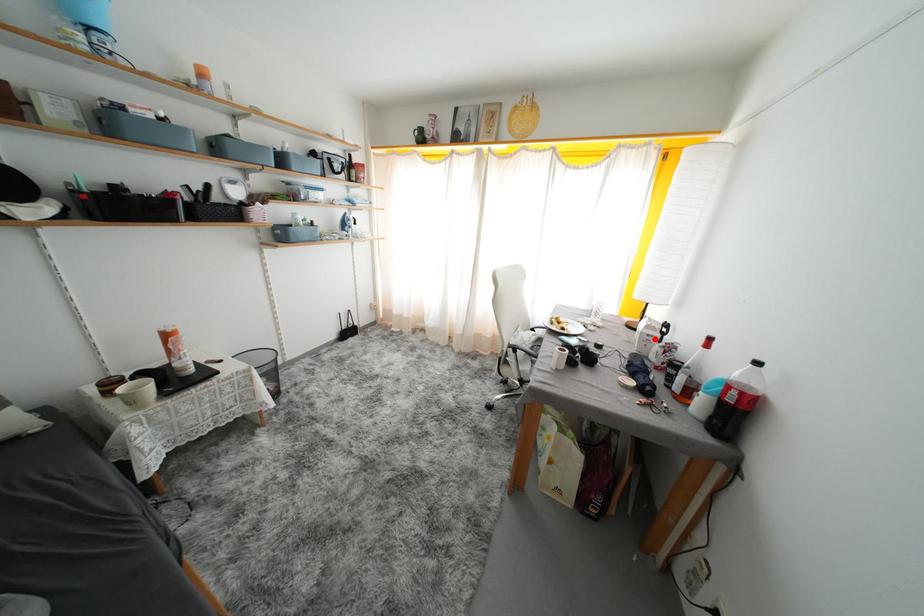
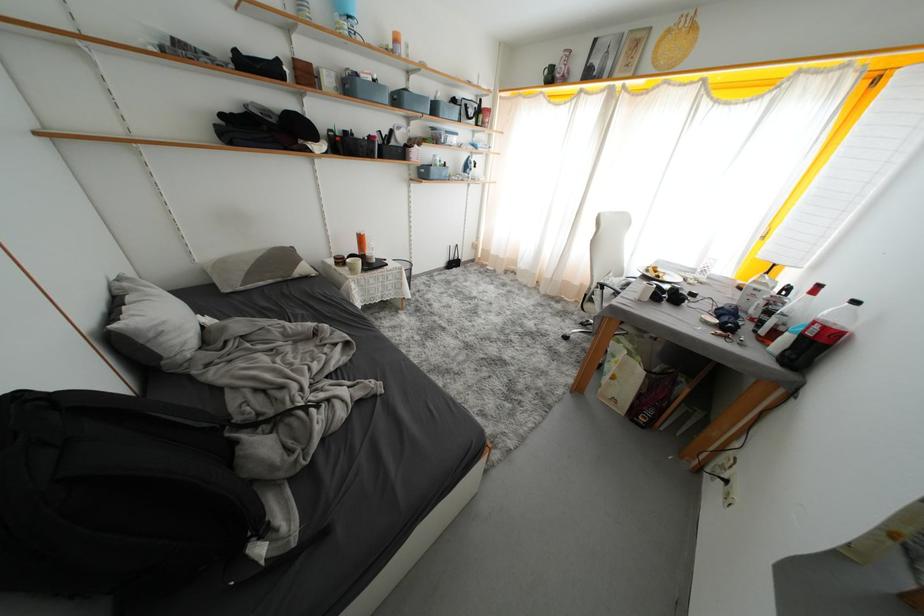
In the second image, find the point that corresponds to the highlighted location in the first image.

(761, 293)